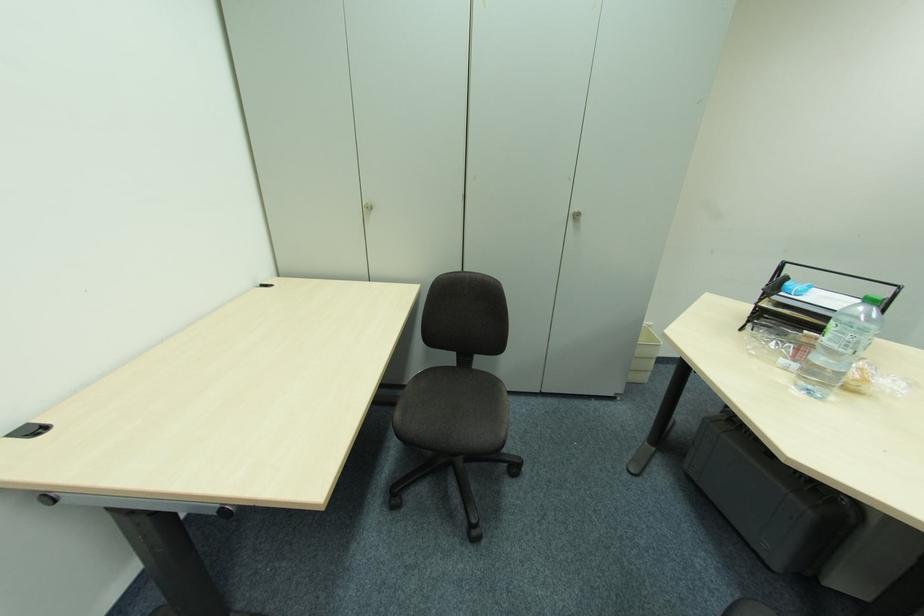
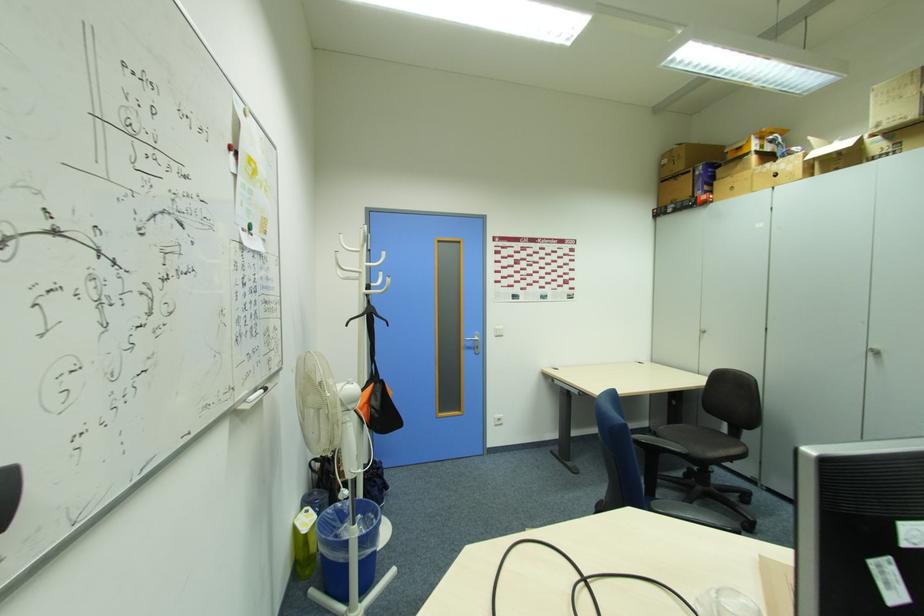
Where in the second image is the point corresponding to [580,217] from the first image?

(880, 354)